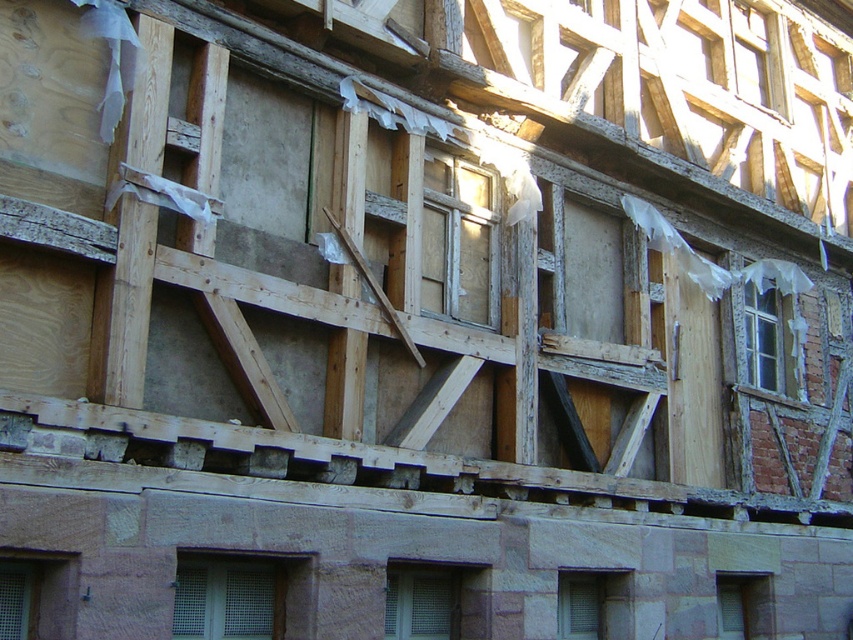
You are standing in front of the building and notice a point marked at coordinates (x=241, y=596). Based on the scene description, what architectural feature does this point most likely represent?

The point at coordinates (x=241, y=596) corresponds to a metallic mesh window at lower center.

You are an architect examining a historical building with half timbered architecture. You notice a point at coordinates (457, 241). What is located at this point?

At point (457, 241) lies transparent glass window at center.

In the scene shown: You are an architect assessing a building with a half timbered style. You notice two windows, the matte gray wooden window at center and transparent plastic window at center right. Which window is taller?

The matte gray wooden window at center is much taller than the transparent plastic window at center right.